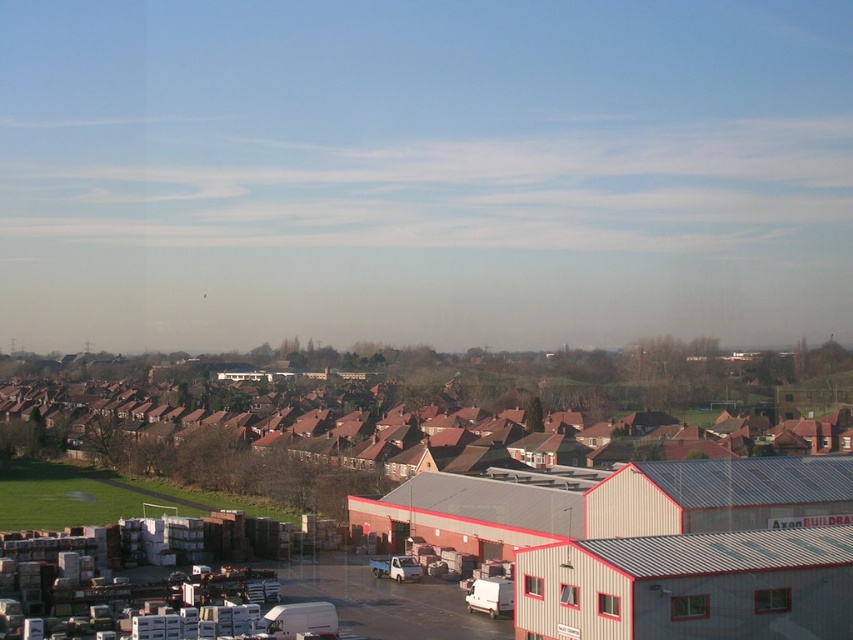
Who is positioned more to the right, white corrugated metal warehouse at center or brown tiled roofs at center?

From the viewer's perspective, white corrugated metal warehouse at center appears more on the right side.

Can you confirm if white corrugated metal warehouse at center is smaller than brown tiled roofs at center?

Indeed, white corrugated metal warehouse at center has a smaller size compared to brown tiled roofs at center.

Who is more forward, (755, 570) or (323, 380)?

Point (755, 570) is in front.

Locate an element on the screen. white corrugated metal warehouse at center is located at coordinates (421, 467).

Who is more forward, (679, 424) or (376, 564)?

Point (376, 564) is more forward.

Which of these two, brown tiled roofs at center or white matte truck at center, stands taller?

brown tiled roofs at center is taller.

Between point (355, 384) and point (396, 564), which one is positioned behind?

Positioned behind is point (355, 384).

Identify the location of brown tiled roofs at center. (416, 413).

Which is in front, point (239, 413) or point (370, 557)?

Positioned in front is point (370, 557).

Between white corrugated metal warehouse at center and white matte truck at center, which one appears on the left side from the viewer's perspective?

Positioned to the left is white matte truck at center.

This screenshot has width=853, height=640. I want to click on white corrugated metal warehouse at center, so click(421, 467).